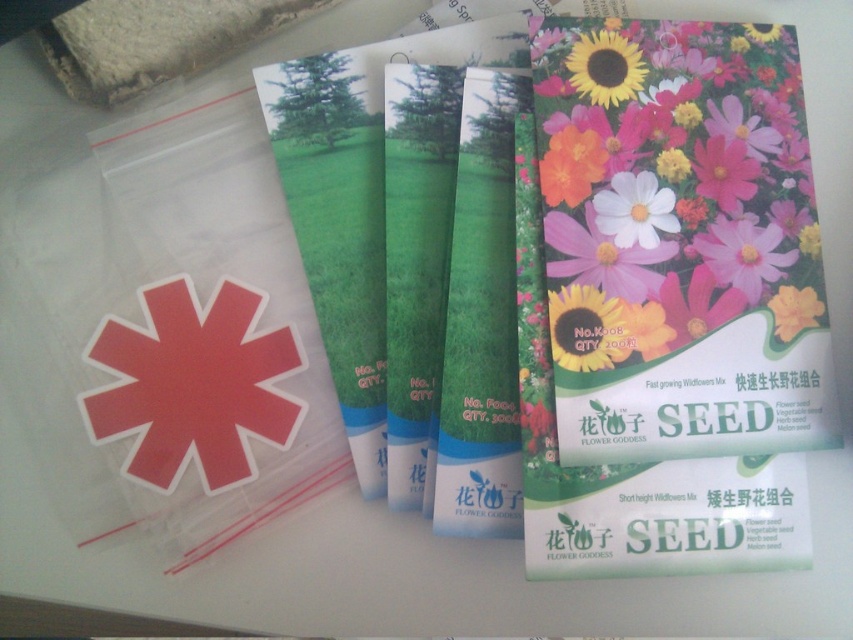
You are organizing a seed display and need to place the matte paper sunflower at right and the yellow matte sunflower at upper right. Which one should you place first if you want to arrange them from top to bottom?

You should place the yellow matte sunflower at upper right first because it is located above the matte paper sunflower at right.

You are looking at the seed packets and want to place a small sticker on the closest point between the two points marked as point (618,465) and point (804,289). Which point should you choose?

Point (618,465) is closer to the viewer than point (804,289), so you should place the sticker on point (618,465).

You are a gardener who wants to plant the green matte tube at center and the yellow matte flower at upper right in a row. Which one should you place first if you want to alternate between wider and narrower plants?

The green matte tube at center might be wider than yellow matte flower at upper right, so you should start with the green matte tube at center to alternate between wider and narrower plants.